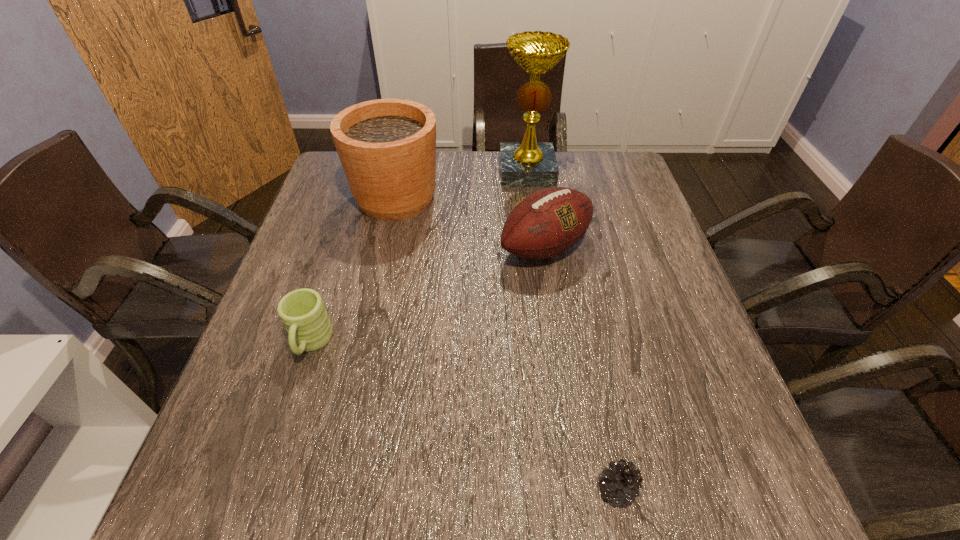
You are a GUI agent. You are given a task and a screenshot of the screen. Output one action in this format:
    pyautogui.click(x=<x>, y=<y>)
    Task: Click on the award
    The image size is (960, 540).
    Given the screenshot: What is the action you would take?
    pyautogui.click(x=529, y=163)

This screenshot has width=960, height=540. Identify the location of flowerpot. (387, 147).

Find the location of `football (American)`. football (American) is located at coordinates (548, 222).

This screenshot has width=960, height=540. I want to click on mug, so click(302, 311).

Locate an element on the screen. the second nearest object is located at coordinates (302, 311).

The width and height of the screenshot is (960, 540). Find the location of `the shortest object`. the shortest object is located at coordinates (621, 485).

I want to click on pinecone, so click(x=621, y=485).

Where is `vacant region located on the front-facing side of the award`? This screenshot has width=960, height=540. vacant region located on the front-facing side of the award is located at coordinates pos(533,212).

At what (x,y) coordinates should I click in order to perform the action: click on free space located 0.160m on the right of the flowerpot. Please return your answer as a coordinate pair (x, y). The width and height of the screenshot is (960, 540). Looking at the image, I should click on (497, 198).

Locate an element on the screen. blank space located 0.230m on the front of the third tallest object is located at coordinates (562, 357).